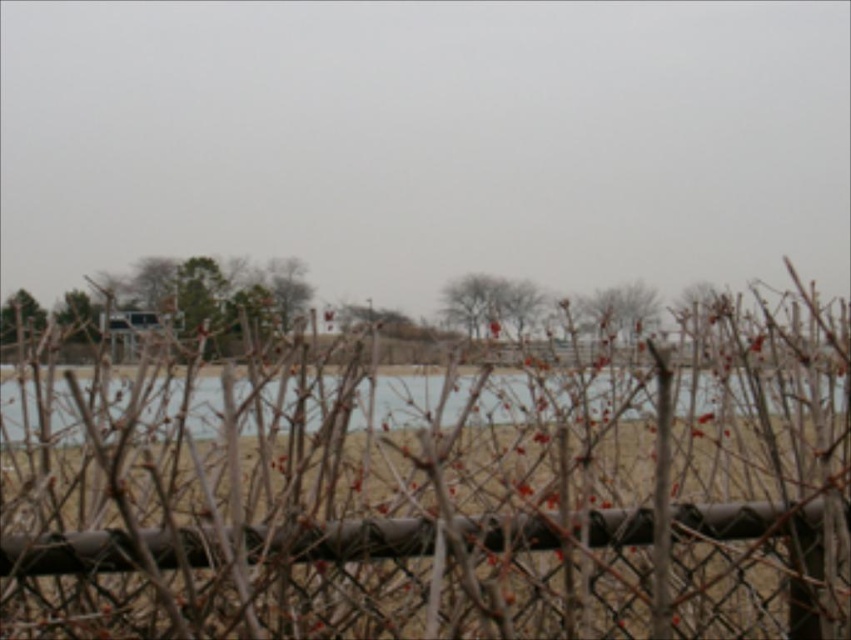
You are standing in a garden and see the brown matte tree at upper center and the bare branches at center. Which one is closer to you?

The bare branches at center are closer to you because the brown matte tree at upper center is behind them.